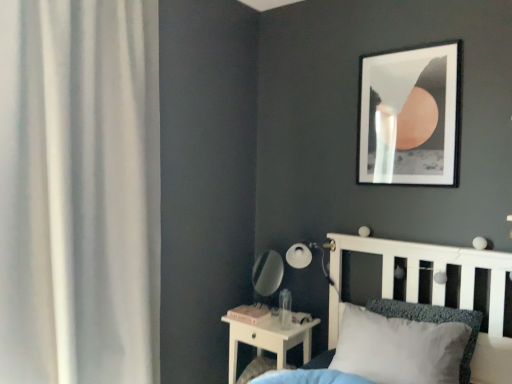
Where is `matte black picture frame at upper right`? This screenshot has width=512, height=384. matte black picture frame at upper right is located at coordinates (410, 116).

Find the location of a particular element. This screenshot has width=512, height=384. matte black table lamp at upper right is located at coordinates (308, 256).

Describe the element at coordinates (268, 339) in the screenshot. I see `white wood nightstand at lower center` at that location.

The width and height of the screenshot is (512, 384). I want to click on shiny silver mirror at center, so click(267, 276).

Is white wood nightstand at lower center with white soft pillow at center?

white wood nightstand at lower center is not next to white soft pillow at center, and they're not touching.

Is white wood nightstand at lower center taller or shorter than white soft pillow at center?

Considering their sizes, white wood nightstand at lower center has more height than white soft pillow at center.

Consider the image. Is white wood nightstand at lower center oriented towards white soft pillow at center?

No, white wood nightstand at lower center is not facing towards white soft pillow at center.

Considering the relative sizes of shiny silver mirror at center and matte black picture frame at upper right in the image provided, is shiny silver mirror at center thinner than matte black picture frame at upper right?

Incorrect, the width of shiny silver mirror at center is not less than that of matte black picture frame at upper right.

From a real-world perspective, is shiny silver mirror at center above or below matte black picture frame at upper right?

From a real-world perspective, shiny silver mirror at center is physically below matte black picture frame at upper right.

Can you see shiny silver mirror at center touching matte black picture frame at upper right?

They are not placed beside each other.

Is matte black picture frame at upper right situated inside white sheer curtain at left or outside?

The correct answer is: outside.

Would you say matte black picture frame at upper right is to the left or to the right of white sheer curtain at left in the picture?

From the image, it's evident that matte black picture frame at upper right is to the right of white sheer curtain at left.

From their relative heights in the image, would you say matte black picture frame at upper right is taller or shorter than white sheer curtain at left?

Considering their sizes, matte black picture frame at upper right has less height than white sheer curtain at left.

Is white sheer curtain at left not inside white soft pillow at center?

Indeed, white sheer curtain at left is completely outside white soft pillow at center.

In terms of height, does white sheer curtain at left look taller or shorter compared to white soft pillow at center?

Clearly, white sheer curtain at left is taller compared to white soft pillow at center.

Visually, is white sheer curtain at left positioned to the left or to the right of white soft pillow at center?

From the image, it's evident that white sheer curtain at left is to the left of white soft pillow at center.

Is white sheer curtain at left aimed at white soft pillow at center?

No.

Based on the photo, is the depth of white sheer curtain at left less than that of white matte bed at center?

No, the depth of white sheer curtain at left is greater than that of white matte bed at center.

Is white sheer curtain at left not near white matte bed at center?

Yes, white sheer curtain at left and white matte bed at center are quite far apart.

Who is smaller, white sheer curtain at left or white matte bed at center?

Smaller between the two is white sheer curtain at left.

Is white sheer curtain at left thinner than white matte bed at center?

Correct, the width of white sheer curtain at left is less than that of white matte bed at center.

Considering the points (263, 348) and (262, 298), which point is in front, point (263, 348) or point (262, 298)?

The point (263, 348) is in front.

Which is in front, white wood nightstand at lower center or shiny silver mirror at center?

white wood nightstand at lower center is in front.

From a real-world perspective, is white wood nightstand at lower center under shiny silver mirror at center?

Yes, from a real-world perspective, white wood nightstand at lower center is under shiny silver mirror at center.

Does white wood nightstand at lower center have a smaller size compared to shiny silver mirror at center?

No, white wood nightstand at lower center is not smaller than shiny silver mirror at center.

Considering the relative positions of white matte bed at center and white wood nightstand at lower center in the image provided, is white matte bed at center to the right of white wood nightstand at lower center from the viewer's perspective?

Indeed, white matte bed at center is positioned on the right side of white wood nightstand at lower center.

Considering the sizes of objects white matte bed at center and white wood nightstand at lower center in the image provided, who is thinner, white matte bed at center or white wood nightstand at lower center?

white wood nightstand at lower center is thinner.

Is white matte bed at center in contact with white wood nightstand at lower center?

No.

In order to click on pillow on the right of white wood nightstand at lower center in this screenshot , I will do `click(434, 323)`.

Find the location of a particular element. This screenshot has height=384, width=512. mirror lying on the left of matte black picture frame at upper right is located at coordinates (267, 276).

Which object lies further to the anchor point white soft pillow at center, white sheer curtain at left or white wood nightstand at lower center?

white sheer curtain at left is positioned further to the anchor white soft pillow at center.

In the scene shown: Which object lies nearer to the anchor point matte black table lamp at upper right, white matte bed at center or matte black picture frame at upper right?

The object closer to matte black table lamp at upper right is white matte bed at center.

Estimate the real-world distances between objects in this image. Which object is further from matte black picture frame at upper right, white soft pillow at center or white wood nightstand at lower center?

Among the two, white wood nightstand at lower center is located further to matte black picture frame at upper right.

From the image, which object appears to be nearer to matte black table lamp at upper right, white soft pillow at center or matte black picture frame at upper right?

white soft pillow at center lies closer to matte black table lamp at upper right than the other object.

Based on their spatial positions, is matte black table lamp at upper right or white soft pillow at center closer to matte black picture frame at upper right?

The object closer to matte black picture frame at upper right is matte black table lamp at upper right.

When comparing their distances from matte black picture frame at upper right, does white wood nightstand at lower center or matte black table lamp at upper right seem further?

white wood nightstand at lower center is positioned further to the anchor matte black picture frame at upper right.

Based on the photo, considering their positions, is matte black picture frame at upper right positioned further to shiny silver mirror at center than white soft pillow at center?

matte black picture frame at upper right is positioned further to the anchor shiny silver mirror at center.

Estimate the real-world distances between objects in this image. Which object is further from white wood nightstand at lower center, matte black picture frame at upper right or shiny silver mirror at center?

Based on the image, matte black picture frame at upper right appears to be further to white wood nightstand at lower center.

Identify the location of nightstand located between white soft pillow at center and matte black table lamp at upper right in the depth direction. Image resolution: width=512 pixels, height=384 pixels. (268, 339).

You are a GUI agent. You are given a task and a screenshot of the screen. Output one action in this format:
    pyautogui.click(x=<x>, y=<y>)
    Task: Click on the nightstand between white matte bed at center and matte black table lamp at upper right from front to back
    
    Given the screenshot: What is the action you would take?
    pyautogui.click(x=268, y=339)

Where is `pillow between matte black picture frame at upper right and white wood nightstand at lower center in the up-down direction`? The height and width of the screenshot is (384, 512). pillow between matte black picture frame at upper right and white wood nightstand at lower center in the up-down direction is located at coordinates (434, 323).

This screenshot has height=384, width=512. I want to click on picture frame between white matte bed at center and white wood nightstand at lower center along the z-axis, so click(410, 116).